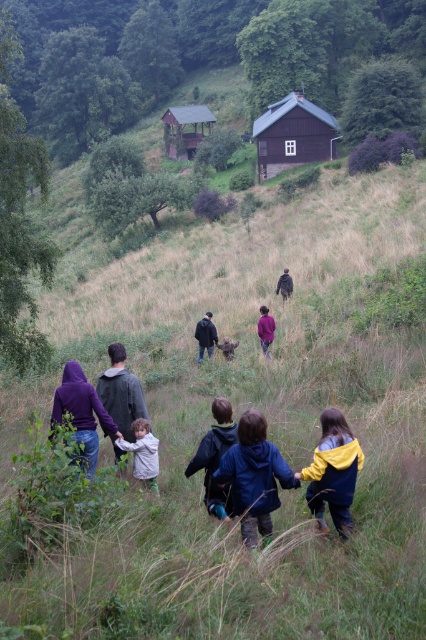
Can you confirm if yellow and blue jacket at lower right is positioned above purple fleece jacket at center?

No.

Consider the image. Can you confirm if yellow and blue jacket at lower right is shorter than purple fleece jacket at center?

Yes.

Who is more forward, (321,515) or (271,323)?

Point (321,515) is in front.

At what (x,y) coordinates should I click in order to perform the action: click on yellow and blue jacket at lower right. Please return your answer as a coordinate pair (x, y). Looking at the image, I should click on (333, 472).

Between point (238, 456) and point (261, 326), which one is positioned behind?

Positioned behind is point (261, 326).

The image size is (426, 640). What do you see at coordinates (253, 476) in the screenshot?
I see `blue fabric jacket at center` at bounding box center [253, 476].

Is point (270, 458) positioned in front of point (270, 328)?

That is True.

Image resolution: width=426 pixels, height=640 pixels. Find the location of `blue fabric jacket at center`. blue fabric jacket at center is located at coordinates (253, 476).

Does light gray fleece jacket at center have a lesser height compared to purple fleece jacket at center?

Yes.

Does light gray fleece jacket at center appear on the right side of purple fleece jacket at center?

Incorrect, light gray fleece jacket at center is not on the right side of purple fleece jacket at center.

Find the location of a particular element. light gray fleece jacket at center is located at coordinates (143, 452).